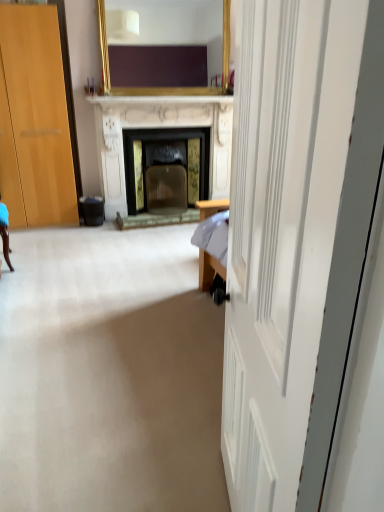
Question: Considering the relative positions of black plastic trash bin at lower left and gold-framed mirror at upper center in the image provided, is black plastic trash bin at lower left to the left of gold-framed mirror at upper center from the viewer's perspective?

Choices:
 (A) yes
 (B) no

Answer: (A)

Question: Can you confirm if black plastic trash bin at lower left is smaller than gold-framed mirror at upper center?

Choices:
 (A) yes
 (B) no

Answer: (A)

Question: Is black plastic trash bin at lower left looking in the opposite direction of gold-framed mirror at upper center?

Choices:
 (A) yes
 (B) no

Answer: (B)

Question: Is there a large distance between black plastic trash bin at lower left and gold-framed mirror at upper center?

Choices:
 (A) no
 (B) yes

Answer: (B)

Question: From a real-world perspective, is black plastic trash bin at lower left over gold-framed mirror at upper center?

Choices:
 (A) yes
 (B) no

Answer: (B)

Question: Considering the positions of white marble fireplace at center and white wooden door at center in the image, is white marble fireplace at center bigger or smaller than white wooden door at center?

Choices:
 (A) big
 (B) small

Answer: (B)

Question: From a real-world perspective, relative to white wooden door at center, is white marble fireplace at center vertically above or below?

Choices:
 (A) above
 (B) below

Answer: (A)

Question: Relative to white wooden door at center, is white marble fireplace at center in front or behind?

Choices:
 (A) front
 (B) behind

Answer: (B)

Question: Is white marble fireplace at center wider or thinner than white wooden door at center?

Choices:
 (A) wide
 (B) thin

Answer: (B)

Question: From the image's perspective, is black plastic trash bin at lower left above or below white marble fireplace at center?

Choices:
 (A) above
 (B) below

Answer: (B)

Question: In the image, is black plastic trash bin at lower left on the left side or the right side of white marble fireplace at center?

Choices:
 (A) left
 (B) right

Answer: (A)

Question: From their relative heights in the image, would you say black plastic trash bin at lower left is taller or shorter than white marble fireplace at center?

Choices:
 (A) short
 (B) tall

Answer: (A)

Question: Is black plastic trash bin at lower left wider or thinner than white marble fireplace at center?

Choices:
 (A) thin
 (B) wide

Answer: (A)

Question: Relative to black plastic trash bin at lower left, is white wooden door at center in front or behind?

Choices:
 (A) behind
 (B) front

Answer: (B)

Question: Would you say white wooden door at center is inside or outside black plastic trash bin at lower left?

Choices:
 (A) outside
 (B) inside

Answer: (A)